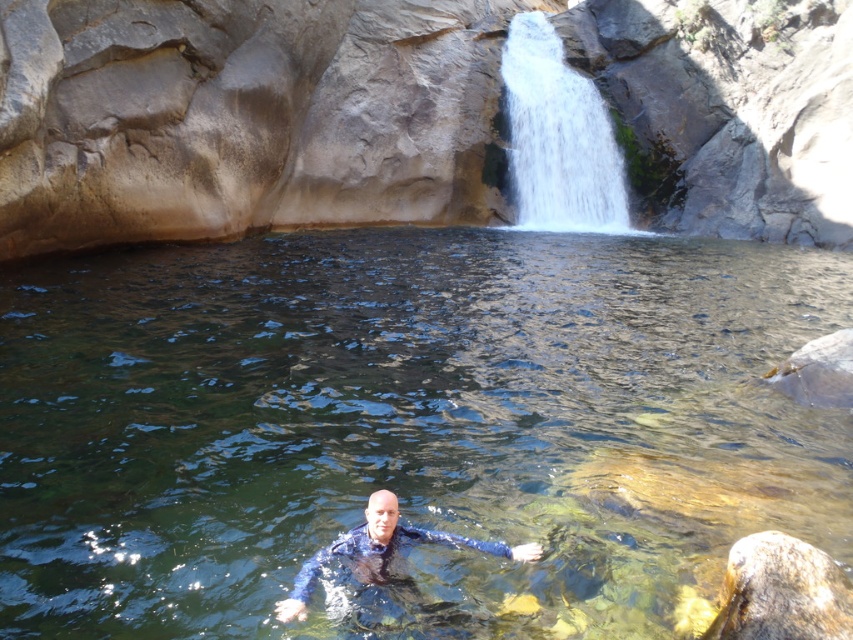
Is point (746, 275) positioned behind point (564, 100)?

No, (746, 275) is closer to viewer.

The width and height of the screenshot is (853, 640). What do you see at coordinates (390, 420) in the screenshot? I see `clear water at center` at bounding box center [390, 420].

Is point (831, 520) farther from viewer compared to point (558, 70)?

That is False.

In order to click on clear water at center in this screenshot , I will do `click(390, 420)`.

Does clear water at center have a lesser width compared to blue rubber wetsuit at center?

No, clear water at center is not thinner than blue rubber wetsuit at center.

Does clear water at center appear on the left side of blue rubber wetsuit at center?

Yes, clear water at center is to the left of blue rubber wetsuit at center.

Does point (0, 632) come in front of point (376, 497)?

Yes, it is.

Locate an element on the screen. The image size is (853, 640). clear water at center is located at coordinates (390, 420).

Does white frothy water at upper center have a greater height compared to blue rubber wetsuit at center?

Yes.

Which is below, white frothy water at upper center or blue rubber wetsuit at center?

Positioned lower is blue rubber wetsuit at center.

Find the location of `white frothy water at upper center`. white frothy water at upper center is located at coordinates click(558, 138).